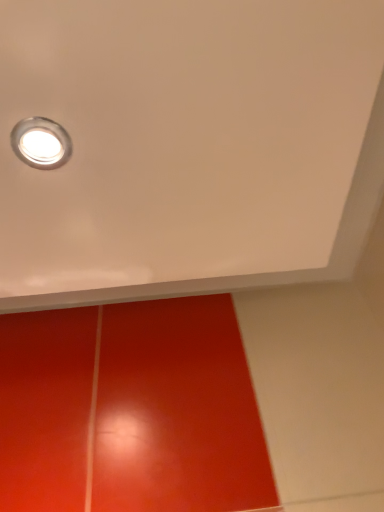
Describe the element at coordinates (41, 143) in the screenshot. I see `matte silver light fixture at upper left` at that location.

Find the location of a particular element. This screenshot has width=384, height=512. matte silver light fixture at upper left is located at coordinates [x=41, y=143].

This screenshot has height=512, width=384. Identify the location of matte silver light fixture at upper left. (41, 143).